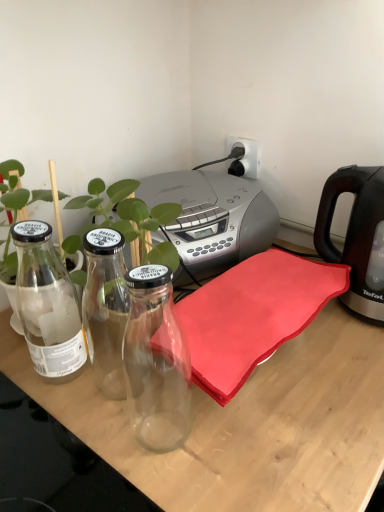
Question: Is white plastic electric outlet at upper center shorter than transparent glass bottles at left?

Choices:
 (A) no
 (B) yes

Answer: (B)

Question: Considering the relative positions of white plastic electric outlet at upper center and transparent glass bottles at left in the image provided, is white plastic electric outlet at upper center behind transparent glass bottles at left?

Choices:
 (A) no
 (B) yes

Answer: (B)

Question: From a real-world perspective, is white plastic electric outlet at upper center on top of transparent glass bottles at left?

Choices:
 (A) yes
 (B) no

Answer: (A)

Question: Is white plastic electric outlet at upper center to the right of transparent glass bottles at left from the viewer's perspective?

Choices:
 (A) no
 (B) yes

Answer: (B)

Question: Is white plastic electric outlet at upper center positioned far away from transparent glass bottles at left?

Choices:
 (A) yes
 (B) no

Answer: (B)

Question: From a real-world perspective, is black plastic kettle at right above or below green leafy plant at left?

Choices:
 (A) above
 (B) below

Answer: (B)

Question: Looking at their shapes, would you say black plastic kettle at right is wider or thinner than green leafy plant at left?

Choices:
 (A) thin
 (B) wide

Answer: (B)

Question: Which is correct: black plastic kettle at right is inside green leafy plant at left, or outside of it?

Choices:
 (A) inside
 (B) outside

Answer: (B)

Question: Based on their positions, is black plastic kettle at right located to the left or right of green leafy plant at left?

Choices:
 (A) right
 (B) left

Answer: (A)

Question: Is black plastic kettle at right inside or outside of clear glass plant at center?

Choices:
 (A) outside
 (B) inside

Answer: (A)

Question: In terms of height, does black plastic kettle at right look taller or shorter compared to clear glass plant at center?

Choices:
 (A) short
 (B) tall

Answer: (A)

Question: Is black plastic kettle at right in front of or behind clear glass plant at center in the image?

Choices:
 (A) behind
 (B) front

Answer: (A)

Question: Considering the positions of black plastic kettle at right and clear glass plant at center in the image, is black plastic kettle at right wider or thinner than clear glass plant at center?

Choices:
 (A) thin
 (B) wide

Answer: (A)

Question: Considering the positions of transparent glass bottles at left and green leafy plant at left in the image, is transparent glass bottles at left taller or shorter than green leafy plant at left?

Choices:
 (A) tall
 (B) short

Answer: (B)

Question: From a real-world perspective, is transparent glass bottles at left physically located above or below green leafy plant at left?

Choices:
 (A) above
 (B) below

Answer: (B)